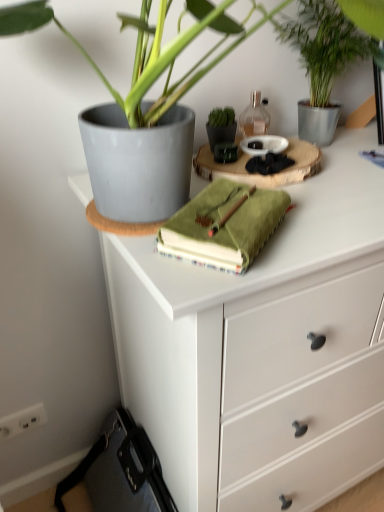
Find the location of a particular element. This screenshot has width=384, height=512. vacant space to the right of translucent glass bottle at upper center is located at coordinates (345, 154).